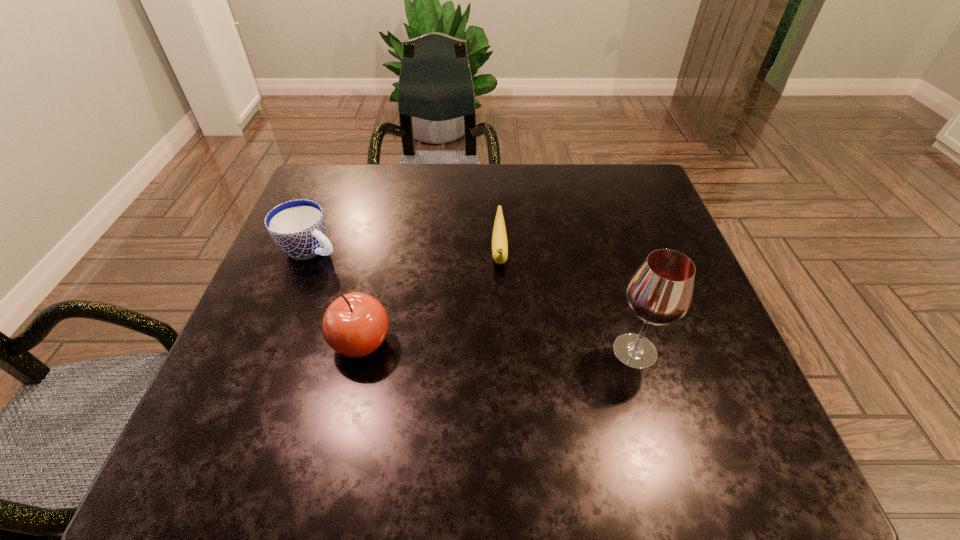
The image size is (960, 540). I want to click on free region located 0.070m at the stem of the second object from right to left, so click(x=501, y=308).

The height and width of the screenshot is (540, 960). I want to click on free space located 0.210m on the side of the cup with the handle, so click(404, 294).

Locate an element on the screen. This screenshot has height=540, width=960. vacant point located 0.230m on the side of the cup with the handle is located at coordinates (411, 297).

Locate an element on the screen. free region located 0.310m on the side of the cup with the handle is located at coordinates (441, 313).

Identify the location of object at the near edge. Image resolution: width=960 pixels, height=540 pixels. (660, 292).

You are a GUI agent. You are given a task and a screenshot of the screen. Output one action in this format:
    pyautogui.click(x=<x>, y=<y>)
    Task: Click on the object that is positioned at the left edge
    
    Given the screenshot: What is the action you would take?
    pyautogui.click(x=298, y=227)

Where is `object that is positioned at the right edge`? Image resolution: width=960 pixels, height=540 pixels. object that is positioned at the right edge is located at coordinates (660, 292).

This screenshot has width=960, height=540. Find the location of `object that is positioned at the near right corner`. object that is positioned at the near right corner is located at coordinates (660, 292).

Image resolution: width=960 pixels, height=540 pixels. In the image, there is a desktop. Find the location of `vacant space at the far edge`. vacant space at the far edge is located at coordinates (455, 172).

The image size is (960, 540). I want to click on free space at the near edge of the desktop, so click(x=579, y=374).